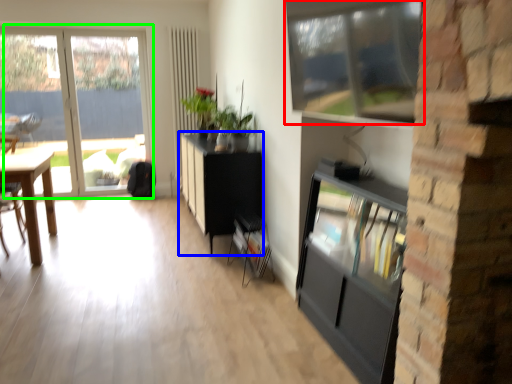
Question: Which is nearer to the window (highlighted by a red box)? cabinetry (highlighted by a blue box) or window (highlighted by a green box).

Choices:
 (A) cabinetry
 (B) window

Answer: (A)